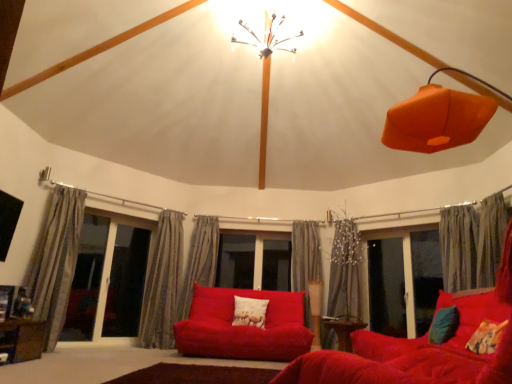
This screenshot has height=384, width=512. I want to click on empty space that is ontop of transparent glass screen door at lower left, which appears as the second screen door when viewed from the left (from a real-world perspective), so click(x=134, y=214).